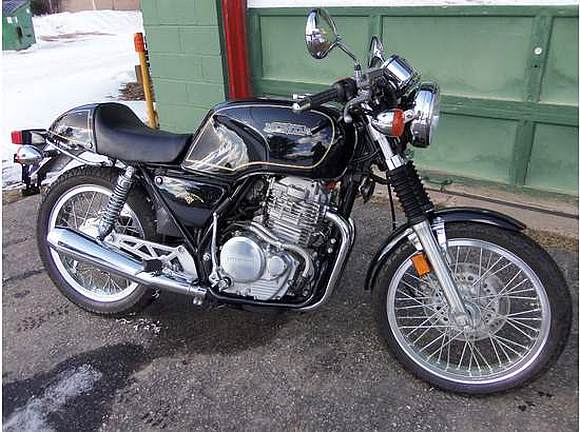
Locate an element on the screen. This screenshot has width=580, height=432. mirror is located at coordinates (329, 28).